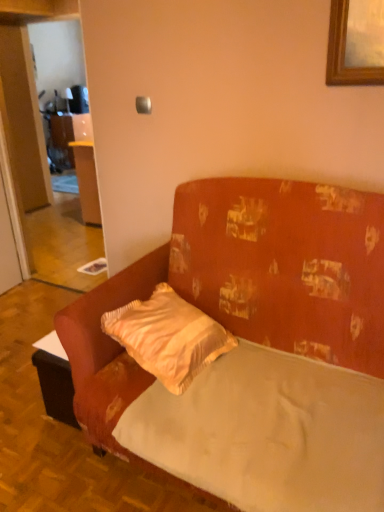
What is the approximate height of velvet orange couch at center?

velvet orange couch at center is 1.12 meters tall.

Image resolution: width=384 pixels, height=512 pixels. Identify the location of smooth white mattress at center. (267, 432).

Between satin yellow pillow at center and smooth white mattress at center, which one is positioned behind?

satin yellow pillow at center is further from the camera.

From the image's perspective, is satin yellow pillow at center located beneath smooth white mattress at center?

No.

Is point (186, 348) less distant than point (318, 362)?

Yes, it is.

Which of these two, satin yellow pillow at center or smooth white mattress at center, is thinner?

Thinner between the two is satin yellow pillow at center.

Is velvet orange couch at center shorter than satin yellow pillow at center?

No.

Considering the positions of objects velvet orange couch at center and satin yellow pillow at center in the image provided, who is more to the right, velvet orange couch at center or satin yellow pillow at center?

A: velvet orange couch at center.

Measure the distance between velvet orange couch at center and satin yellow pillow at center.

velvet orange couch at center is 8.47 inches away from satin yellow pillow at center.

Would you say velvet orange couch at center is outside satin yellow pillow at center?

Yes, velvet orange couch at center is not within satin yellow pillow at center.

In terms of size, does smooth white mattress at center appear bigger or smaller than satin yellow pillow at center?

Clearly, smooth white mattress at center is larger in size than satin yellow pillow at center.

In the scene shown: Is satin yellow pillow at center completely or partially inside smooth white mattress at center?

No, satin yellow pillow at center is located outside of smooth white mattress at center.

Is smooth white mattress at center looking in the opposite direction of satin yellow pillow at center?

No, satin yellow pillow at center is not at the back of smooth white mattress at center.

Which of these two, satin yellow pillow at center or velvet orange couch at center, is smaller?

With smaller size is satin yellow pillow at center.

Would you say satin yellow pillow at center is inside or outside velvet orange couch at center?

satin yellow pillow at center can be found inside velvet orange couch at center.

Considering the sizes of satin yellow pillow at center and velvet orange couch at center in the image, is satin yellow pillow at center wider or thinner than velvet orange couch at center?

Clearly, satin yellow pillow at center has less width compared to velvet orange couch at center.

In the image, is satin yellow pillow at center positioned in front of or behind velvet orange couch at center?

Clearly, satin yellow pillow at center is behind velvet orange couch at center.

Which is farther, (x=303, y=470) or (x=344, y=218)?

Positioned behind is point (x=344, y=218).

Which object is more forward, smooth white mattress at center or velvet orange couch at center?

velvet orange couch at center.

Is smooth white mattress at center inside or outside of velvet orange couch at center?

smooth white mattress at center is located inside velvet orange couch at center.

Based on the photo, which object is wider, velvet orange couch at center or smooth white mattress at center?

With larger width is velvet orange couch at center.

Is velvet orange couch at center not close to smooth white mattress at center?

No, velvet orange couch at center is not far away from smooth white mattress at center.

Looking at this image, how different are the orientations of velvet orange couch at center and smooth white mattress at center in degrees?

They differ by 1.5 degrees in their facing directions.

Can you confirm if velvet orange couch at center is taller than smooth white mattress at center?

Yes.

Where is `pillow above the smooth white mattress at center (from the image's perspective)`? The height and width of the screenshot is (512, 384). pillow above the smooth white mattress at center (from the image's perspective) is located at coordinates (168, 337).

This screenshot has width=384, height=512. Find the location of `studio couch on the right side of satin yellow pillow at center`. studio couch on the right side of satin yellow pillow at center is located at coordinates (253, 348).

Looking at the image, which one is located further to smooth white mattress at center, velvet orange couch at center or satin yellow pillow at center?

satin yellow pillow at center is further to smooth white mattress at center.

When comparing their distances from satin yellow pillow at center, does velvet orange couch at center or smooth white mattress at center seem further?

The object further to satin yellow pillow at center is smooth white mattress at center.

Which object lies nearer to the anchor point satin yellow pillow at center, smooth white mattress at center or velvet orange couch at center?

velvet orange couch at center lies closer to satin yellow pillow at center than the other object.

Looking at the image, which one is located further to velvet orange couch at center, smooth white mattress at center or satin yellow pillow at center?

satin yellow pillow at center is positioned further to the anchor velvet orange couch at center.

Estimate the real-world distances between objects in this image. Which object is further from velvet orange couch at center, satin yellow pillow at center or smooth white mattress at center?

Among the two, satin yellow pillow at center is located further to velvet orange couch at center.

Based on their spatial positions, is satin yellow pillow at center or velvet orange couch at center closer to smooth white mattress at center?

Among the two, velvet orange couch at center is located nearer to smooth white mattress at center.

At what (x,y) coordinates should I click in order to perform the action: click on mattress between velvet orange couch at center and satin yellow pillow at center in the front-back direction. Please return your answer as a coordinate pair (x, y). The width and height of the screenshot is (384, 512). Looking at the image, I should click on (267, 432).